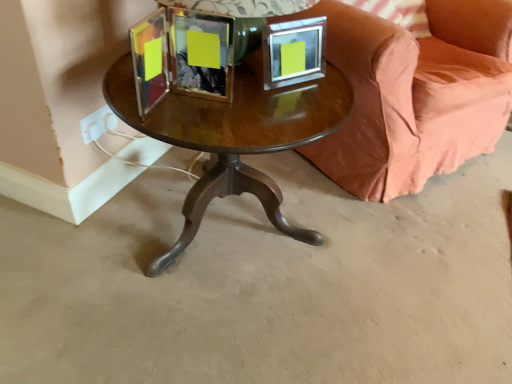
Question: Does metallic silver picture frame at upper center turn towards velvet coral couch at center?

Choices:
 (A) yes
 (B) no

Answer: (B)

Question: Can velvet coral couch at center be found inside metallic silver picture frame at upper center?

Choices:
 (A) yes
 (B) no

Answer: (B)

Question: Is metallic silver picture frame at upper center next to velvet coral couch at center?

Choices:
 (A) no
 (B) yes

Answer: (A)

Question: Is metallic silver picture frame at upper center at the left side of velvet coral couch at center?

Choices:
 (A) no
 (B) yes

Answer: (B)

Question: From the image's perspective, does metallic silver picture frame at upper center appear higher than velvet coral couch at center?

Choices:
 (A) yes
 (B) no

Answer: (B)

Question: Relative to velvet coral couch at center, is brown polished wood table at center in front or behind?

Choices:
 (A) front
 (B) behind

Answer: (A)

Question: From a real-world perspective, is brown polished wood table at center positioned above or below velvet coral couch at center?

Choices:
 (A) above
 (B) below

Answer: (B)

Question: In terms of height, does brown polished wood table at center look taller or shorter compared to velvet coral couch at center?

Choices:
 (A) tall
 (B) short

Answer: (B)

Question: Is brown polished wood table at center inside the boundaries of velvet coral couch at center, or outside?

Choices:
 (A) outside
 (B) inside

Answer: (A)

Question: Is point (372, 190) positioned closer to the camera than point (409, 23)?

Choices:
 (A) closer
 (B) farther

Answer: (A)

Question: Would you say velvet coral couch at center is inside or outside pink fabric pillow at upper right?

Choices:
 (A) outside
 (B) inside

Answer: (A)

Question: Considering their positions, is velvet coral couch at center located in front of or behind pink fabric pillow at upper right?

Choices:
 (A) front
 (B) behind

Answer: (A)

Question: From a real-world perspective, is velvet coral couch at center above or below pink fabric pillow at upper right?

Choices:
 (A) above
 (B) below

Answer: (B)

Question: Is metallic silver picture frame at upper center taller or shorter than shiny brown wood coffee table at center?

Choices:
 (A) tall
 (B) short

Answer: (B)

Question: Is metallic silver picture frame at upper center bigger or smaller than shiny brown wood coffee table at center?

Choices:
 (A) big
 (B) small

Answer: (B)